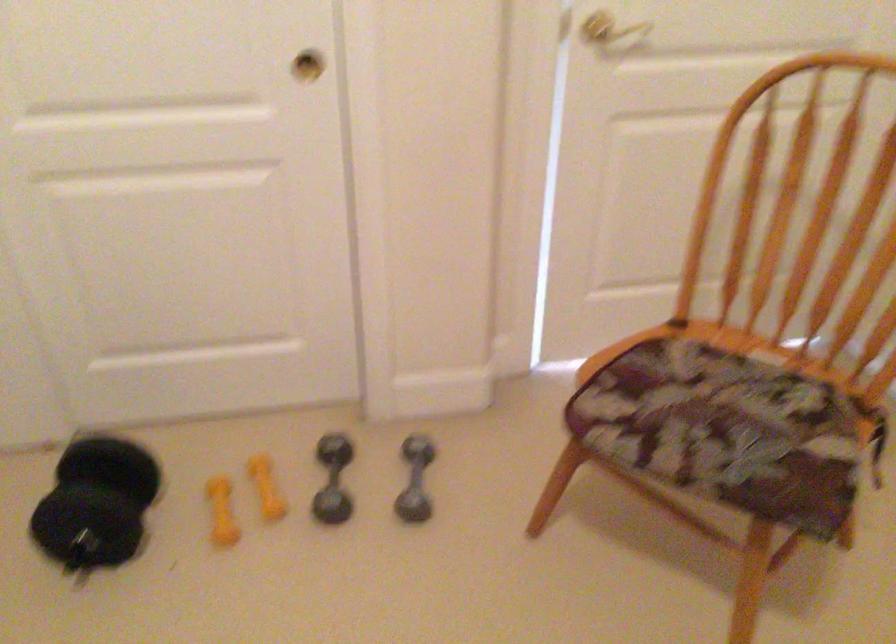
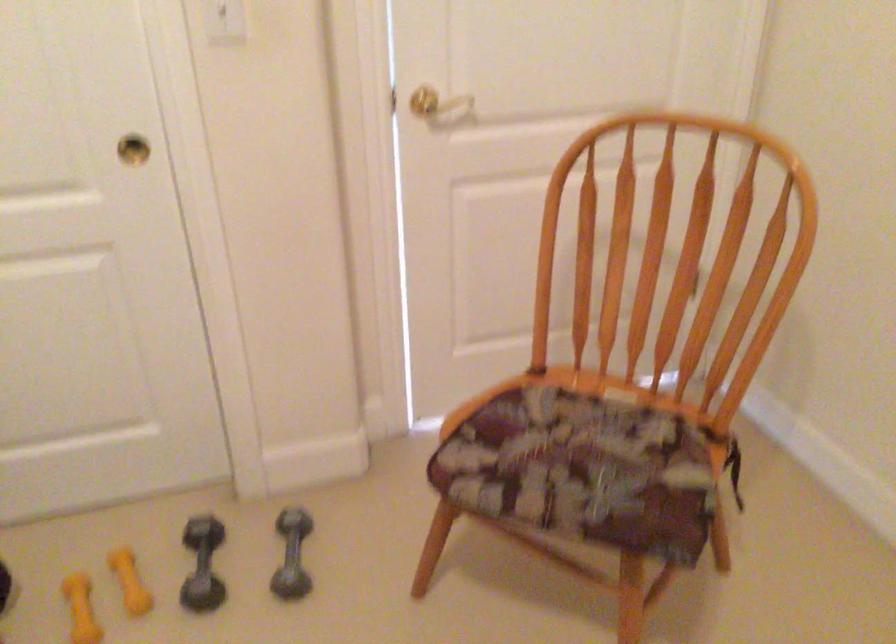
Locate, in the second image, the point that corresponds to (419,478) in the first image.

(291, 554)